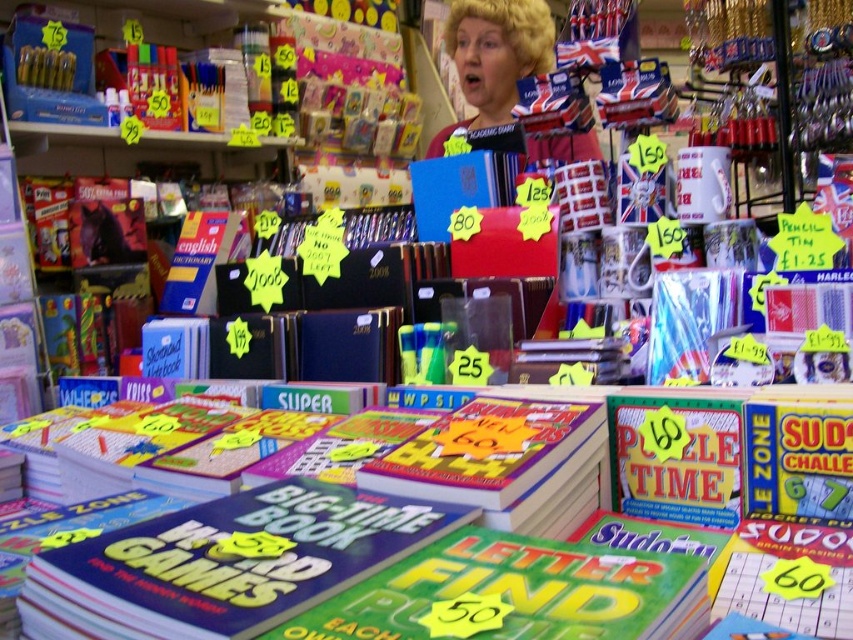
You are a customer in the store and want to buy a book. You notice the matte yellow book at center and the blonde hair at upper center. Which item is thinner?

The matte yellow book at center is thinner than the blonde hair at upper center.

You are standing in a store and see two points in the scene. The first point is at coordinates point [190,552] and the second is at point [497,122]. Which point is closer to you?

Point [190,552] is closer to the viewer than point [497,122].